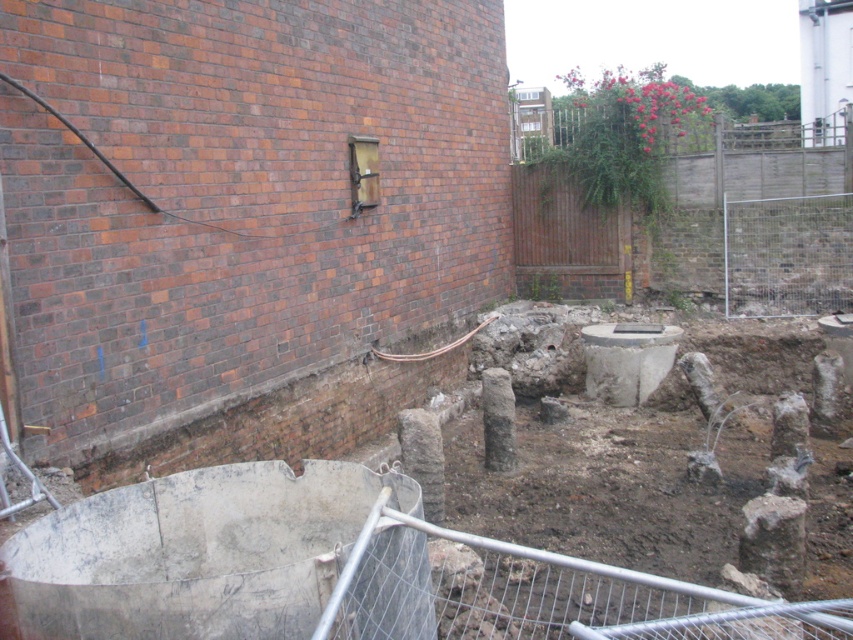
You are a construction worker standing at the edge of the fenced area. You see two points marked on the wall, one at coordinates point (595, 260) and the other at point (657, 332). Which point is closer to you?

Point (595, 260) is further to the camera than point (657, 332), so the point closer to you is point (657, 332).

You are standing at the center of the construction site and see the point marked at coordinates [759,221]. What object is located at this point?

The point marked at coordinates [759,221] marks the brown wooden fence at upper right.

You are a construction worker who needs to ensure safety by checking the height of the brown wooden fence at upper right and the smooth concrete hole at center. Which object is taller?

The brown wooden fence at upper right is taller than the smooth concrete hole at center.